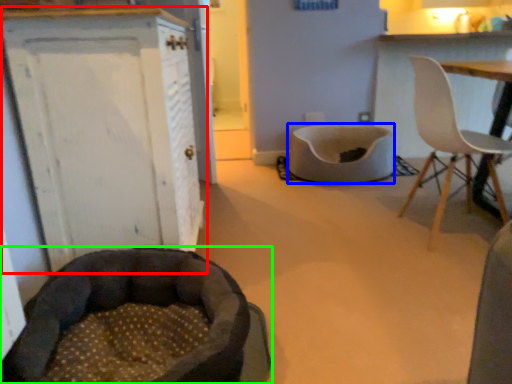
Question: Which object is the closest to the cabinetry (highlighted by a red box)? Choose among these: cat bed (highlighted by a blue box) or dog bed (highlighted by a green box).

Choices:
 (A) cat bed
 (B) dog bed

Answer: (B)